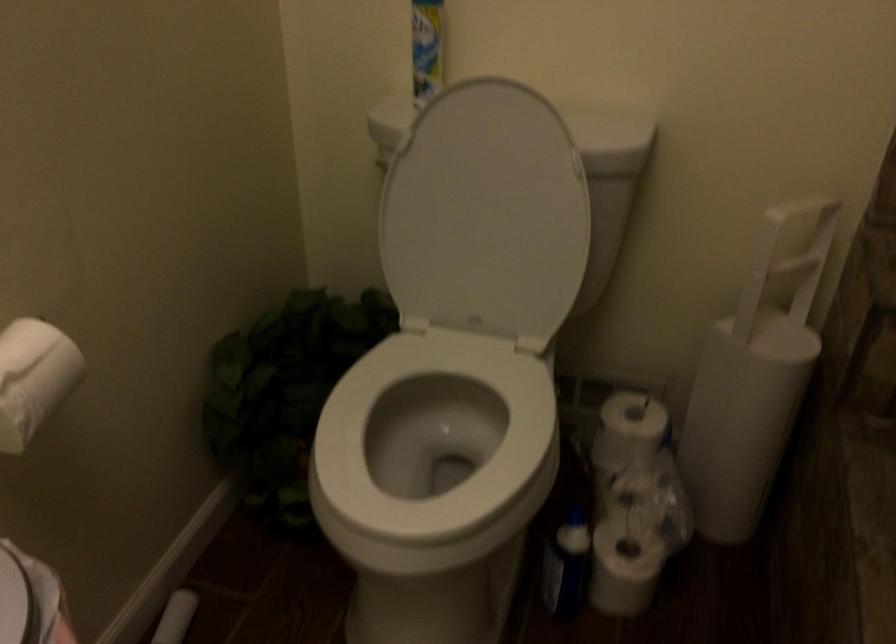
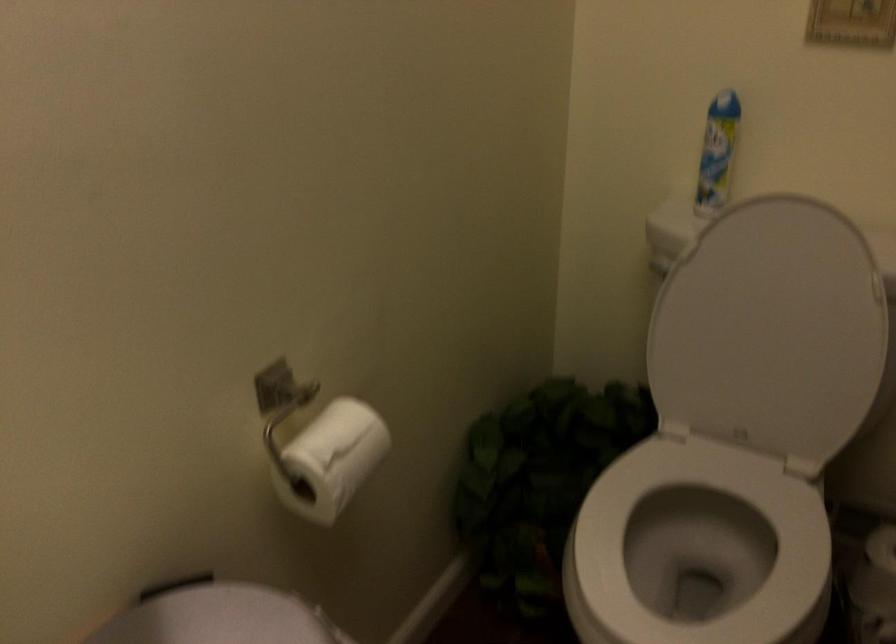
The point at (494, 219) is marked in the first image. Where is the corresponding point in the second image?

(771, 330)